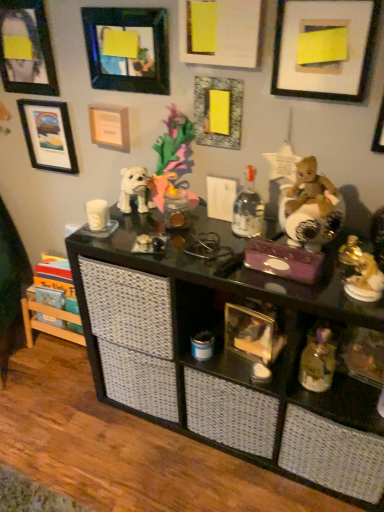
The image size is (384, 512). What are the coordinates of `vacant space that is to the left of gold metallic figurine at right, marked as the second toy in a bottom-to-top arrangement` in the screenshot? It's located at (319, 289).